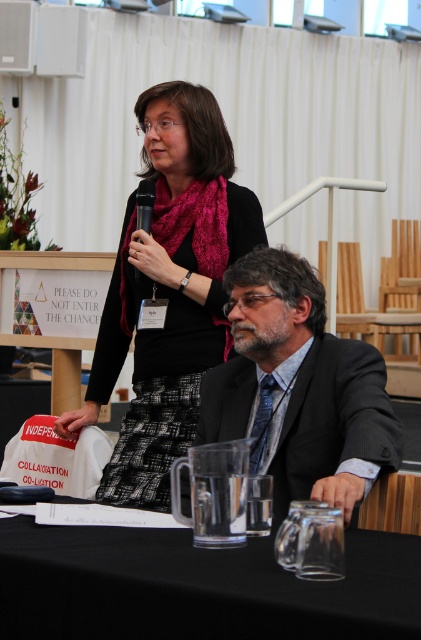
You are a stagehand setting up for a conference. You need to place a 2.0 meter long extension cord from the black glass table at lower center to the black plastic microphone at upper center. Will the cord be long enough?

The distance between the black glass table at lower center and the black plastic microphone at upper center is 1.99 meters. The 2.0 meter extension cord is slightly longer than needed, so it will be long enough to reach.

You are standing in the conference room and need to place a document on the black glass table at lower center. According to the coordinates provided, where exactly should you place it?

The black glass table at lower center is located at point (x=197, y=586), so you should place the document there.